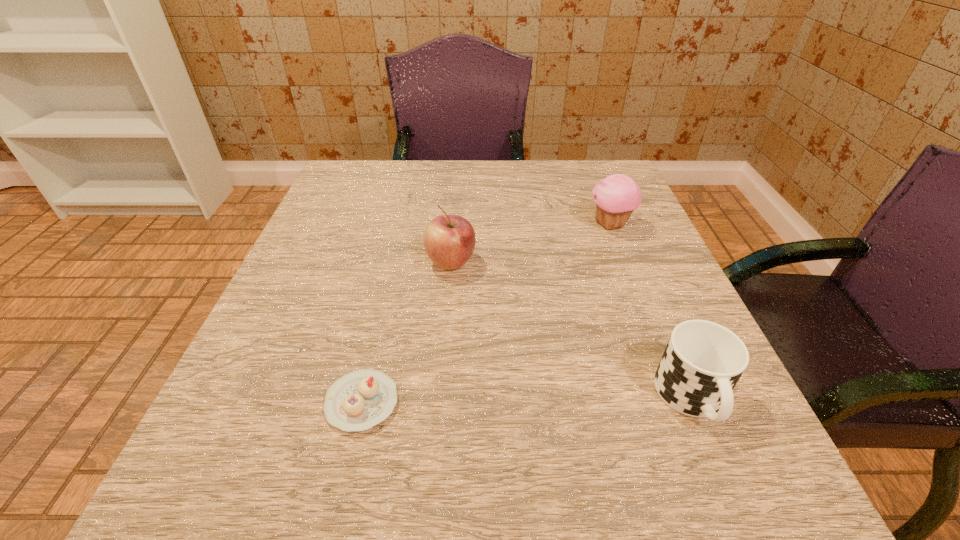
Where is `free space between the leftmost object and the taller cupcake`? Image resolution: width=960 pixels, height=540 pixels. free space between the leftmost object and the taller cupcake is located at coordinates (487, 313).

At what (x,y) coordinates should I click in order to perform the action: click on object that stands as the third closest to the third nearest object. Please return your answer as a coordinate pair (x, y). This screenshot has width=960, height=540. Looking at the image, I should click on (703, 361).

Identify which object is the second closest to the cup. Please provide its 2D coordinates. Your answer should be formatted as a tuple, i.e. [(x, y)], where the tuple contains the x and y coordinates of a point satisfying the conditions above.

[(449, 240)]